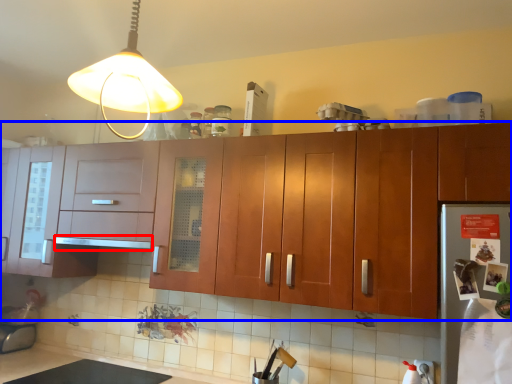
Question: Which object is further to the camera taking this photo, exhaust hood (highlighted by a red box) or cabinetry (highlighted by a blue box)?

Choices:
 (A) exhaust hood
 (B) cabinetry

Answer: (A)